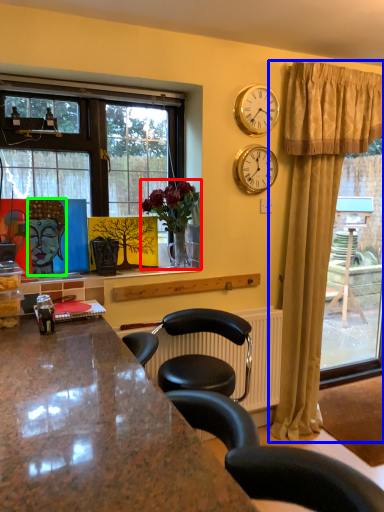
Question: Which is nearer to the houseplant (highlighted by a red box)? curtain (highlighted by a blue box) or person (highlighted by a green box).

Choices:
 (A) curtain
 (B) person

Answer: (B)